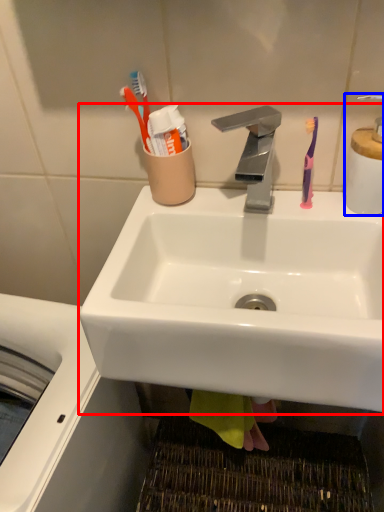
Question: Which object appears farthest to the camera in this image, sink (highlighted by a red box) or soap dispenser (highlighted by a blue box)?

Choices:
 (A) sink
 (B) soap dispenser

Answer: (B)